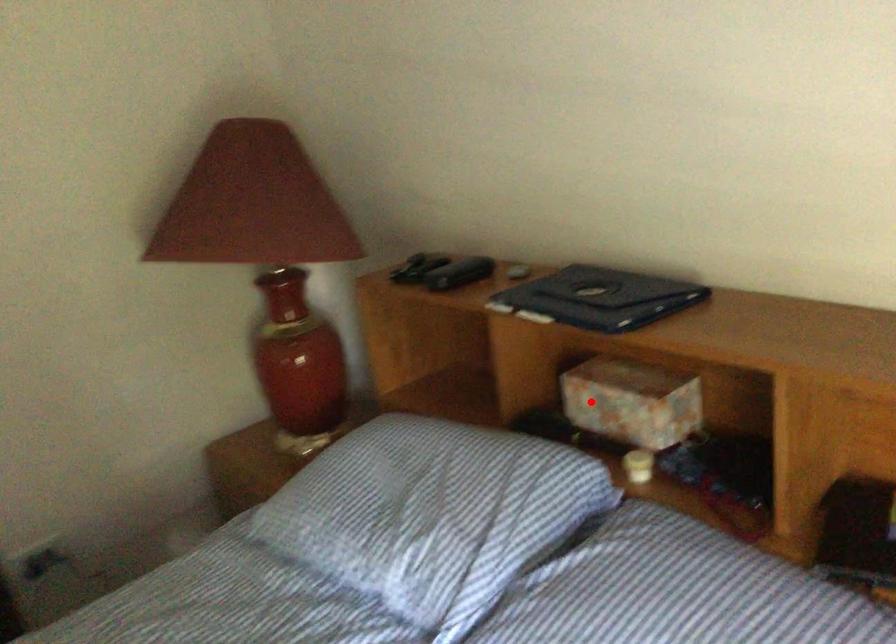
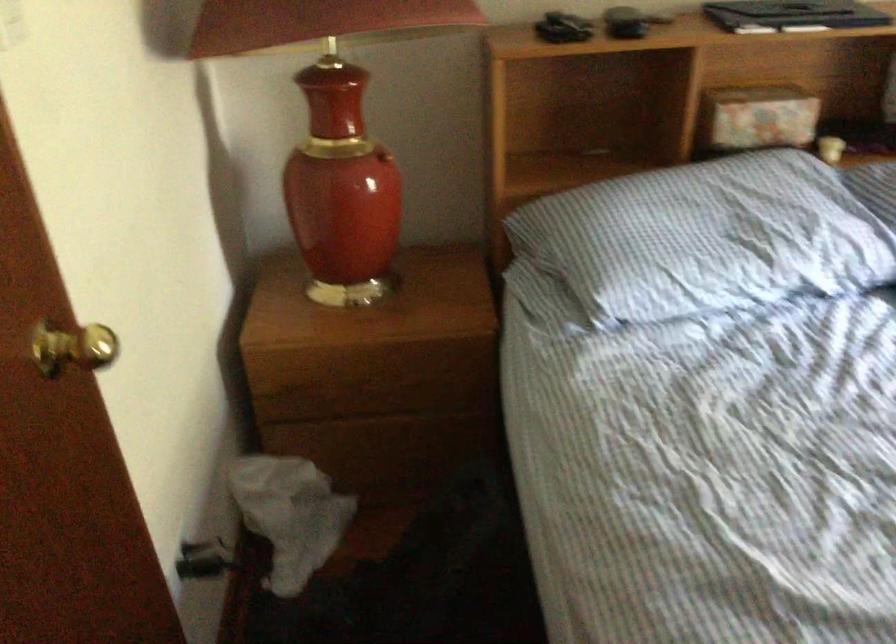
In the second image, find the point that corresponds to the highlighted location in the first image.

(757, 118)